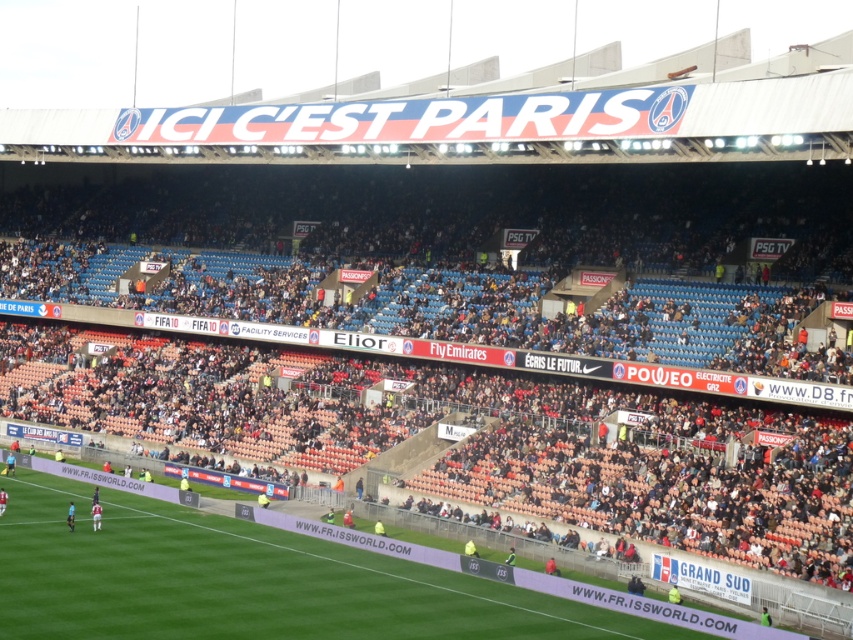
Question: Which object appears closest to the camera in this image?

Choices:
 (A) green grass football field at center
 (B) orange plastic seats at center

Answer: (A)

Question: Is orange plastic seats at center closer to camera compared to green grass football field at center?

Choices:
 (A) yes
 (B) no

Answer: (B)

Question: Can you confirm if orange plastic seats at center is smaller than green grass football field at center?

Choices:
 (A) yes
 (B) no

Answer: (B)

Question: Which of the following is the farthest from the observer?

Choices:
 (A) green grass football field at center
 (B) orange plastic seats at center

Answer: (B)

Question: Does orange plastic seats at center lie in front of green grass football field at center?

Choices:
 (A) yes
 (B) no

Answer: (B)